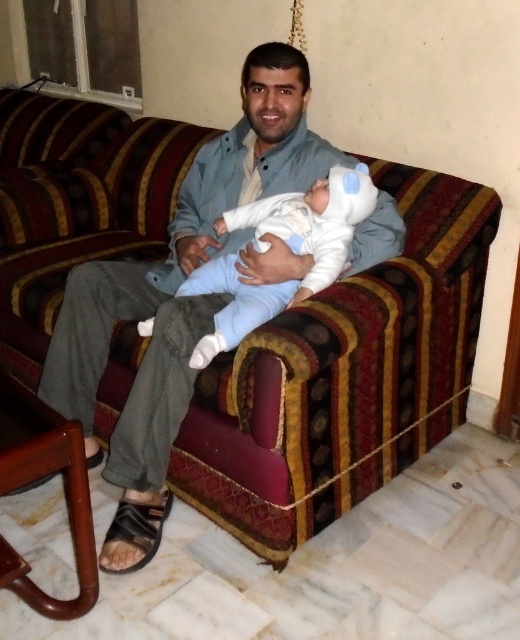
Can you confirm if light blue denim shirt at center is taller than white soft baby at center?

Indeed, light blue denim shirt at center has a greater height compared to white soft baby at center.

Which is below, light blue denim shirt at center or white soft baby at center?

Positioned lower is light blue denim shirt at center.

The width and height of the screenshot is (520, 640). Find the location of `light blue denim shirt at center`. light blue denim shirt at center is located at coordinates (175, 298).